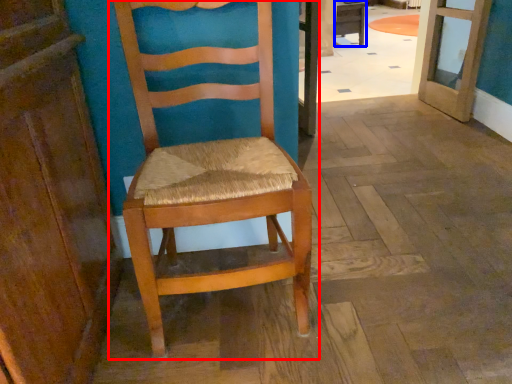
Question: Which point is closer to the camera, chair (highlighted by a red box) or table (highlighted by a blue box)?

Choices:
 (A) chair
 (B) table

Answer: (A)